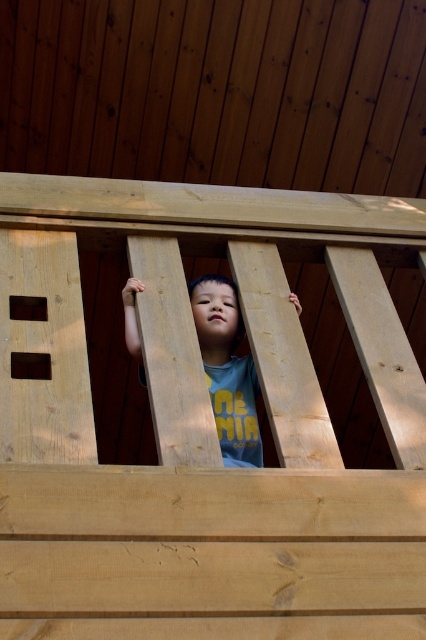
Question: Which point appears closest to the camera in this image?

Choices:
 (A) 360,321
 (B) 210,340

Answer: (A)

Question: Does natural wood bunk bed at center appear on the right side of matte wood child at center?

Choices:
 (A) no
 (B) yes

Answer: (A)

Question: Which point is farther from the camera taking this photo?

Choices:
 (A) (227, 440)
 (B) (267, 285)

Answer: (B)

Question: Does natural wood bunk bed at center appear under matte wood child at center?

Choices:
 (A) no
 (B) yes

Answer: (A)

Question: Does natural wood bunk bed at center have a smaller size compared to matte wood child at center?

Choices:
 (A) no
 (B) yes

Answer: (A)